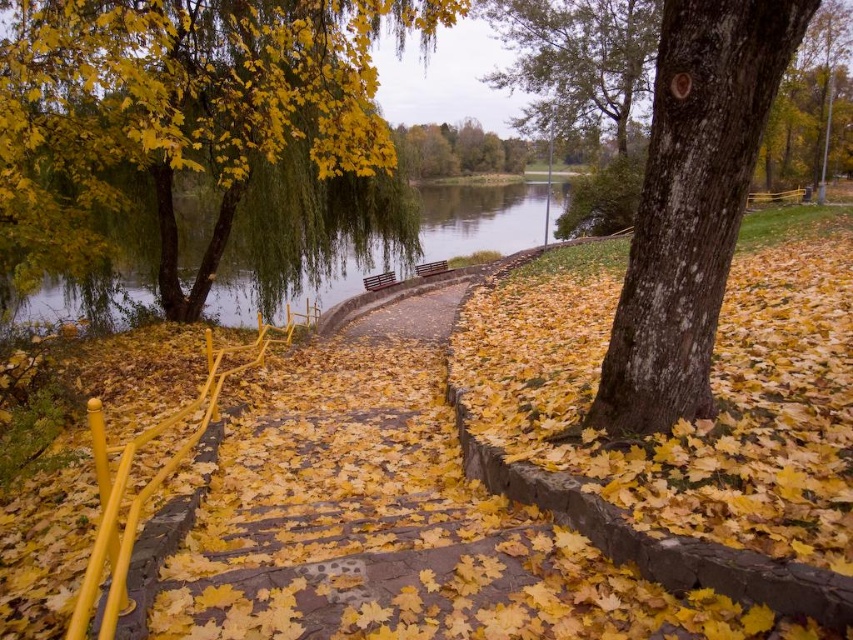
Based on the photo, is green rough bark tree at upper center to the left of wooden bench at center from the viewer's perspective?

In fact, green rough bark tree at upper center is to the right of wooden bench at center.

Find the location of a particular element. The height and width of the screenshot is (640, 853). green rough bark tree at upper center is located at coordinates (576, 56).

Is point (595, 80) more distant than point (434, 264)?

That is True.

Identify the location of green rough bark tree at upper center. (576, 56).

Is greenish water at center shorter than green rough bark tree at upper center?

No, greenish water at center is not shorter than green rough bark tree at upper center.

Which is below, greenish water at center or green rough bark tree at upper center?

greenish water at center is below.

Does point (426, 218) lie behind point (622, 116)?

Yes, point (426, 218) is behind point (622, 116).

Locate an element on the screen. The height and width of the screenshot is (640, 853). greenish water at center is located at coordinates (479, 218).

Which of these two, yellow/glossy tree at upper left or smooth brown bark at center, stands shorter?

Standing shorter between the two is smooth brown bark at center.

This screenshot has height=640, width=853. In order to click on yellow/glossy tree at upper left in this screenshot , I will do `click(183, 108)`.